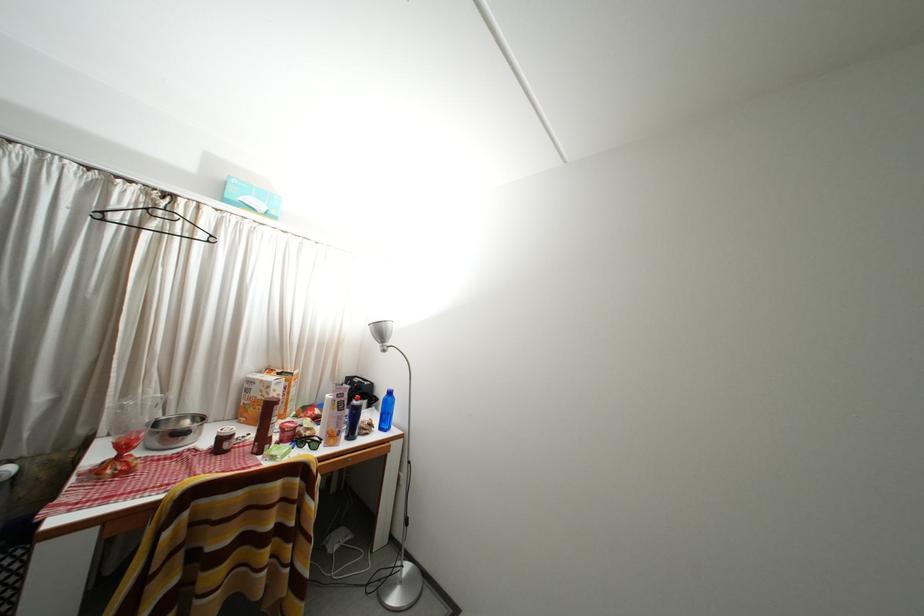
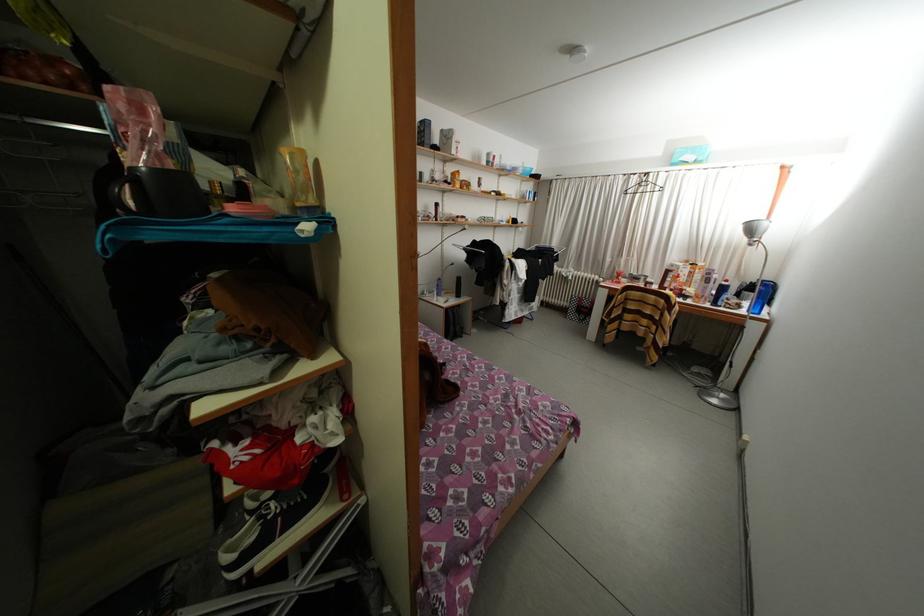
Where in the second image is the point corresponding to [379,431] from the first image?

(747, 310)